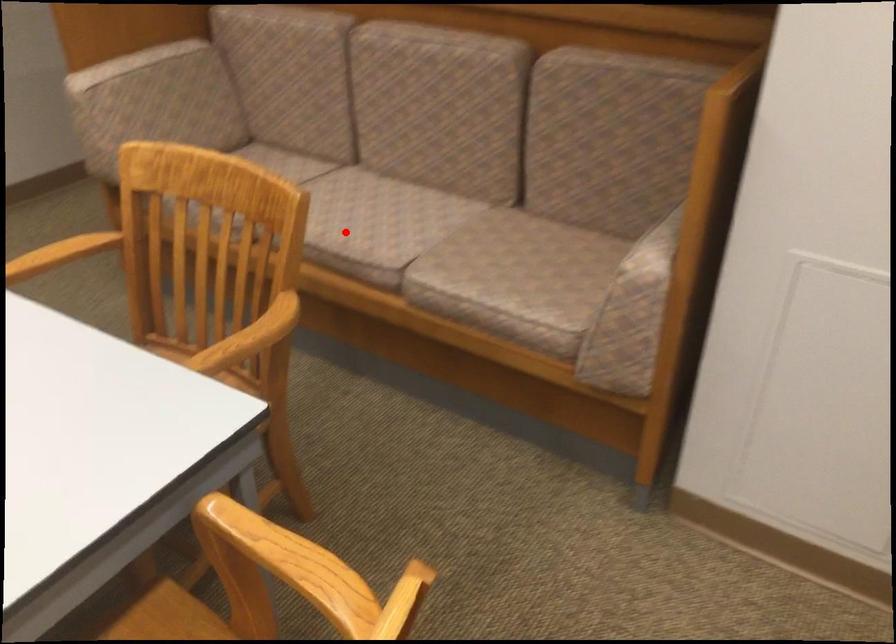
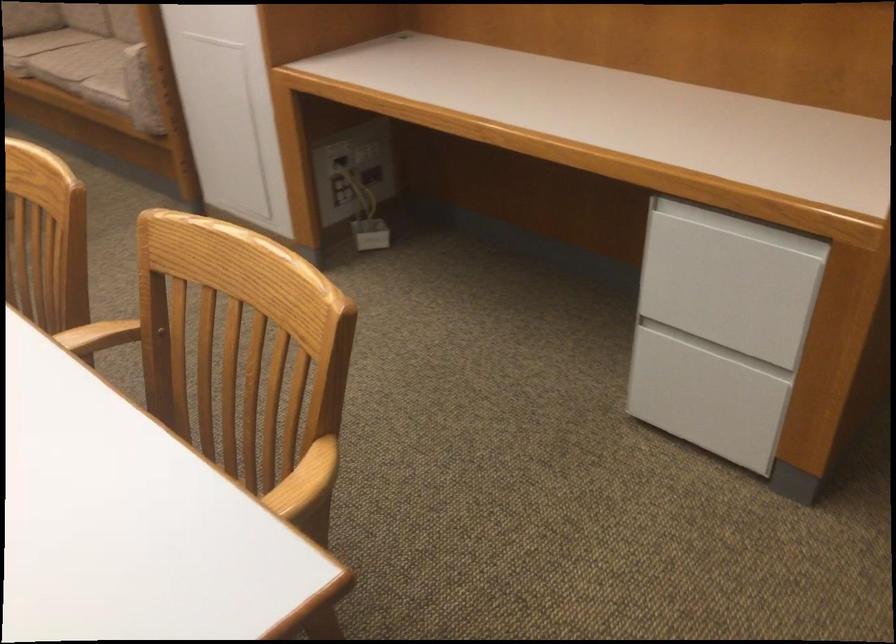
The point at the highlighted location is marked in the first image. Where is the corresponding point in the second image?

(76, 61)